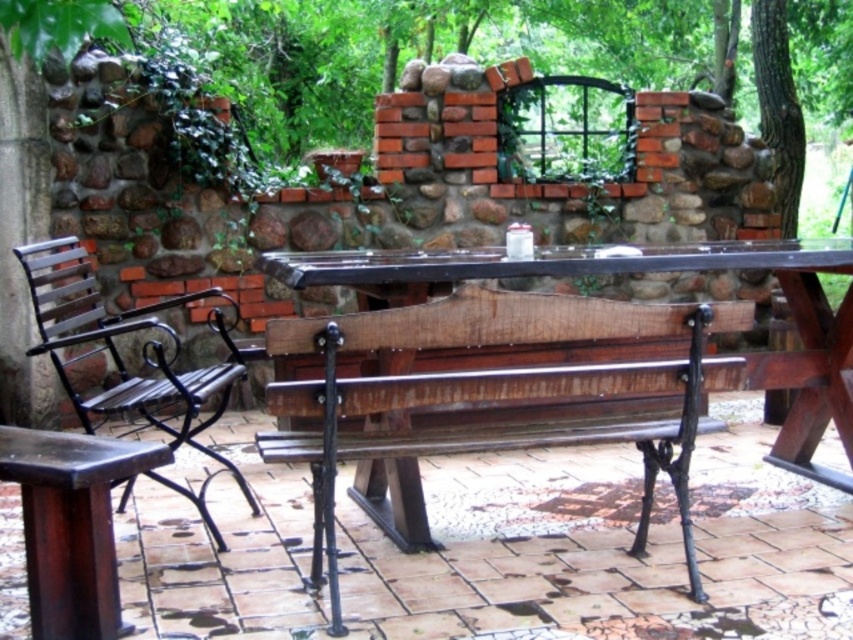
You are sitting on the rustic wood bench at center and want to place a small potted plant between yourself and the black wrought iron chair at left. Is the space between them sufficient for the plant?

The rustic wood bench at center is in front of the black wrought iron chair at left, so there is space between them. The small potted plant can be placed there.

You are a gardener who needs to move the dark brown wood stool at lower left to a different location. However, you notice the rustic wood bench at center is currently blocking your path. Can you move the stool without moving the bench first?

The rustic wood bench at center is positioned over dark brown wood stool at lower left, so you cannot move the dark brown wood stool at lower left without first moving the rustic wood bench at center.

You are a guest at this outdoor seating area and want to choose a seat that is lower to the ground. Which one should you pick between the black wrought iron chair at left and the dark brown wood stool at lower left?

The dark brown wood stool at lower left is shorter than the black wrought iron chair at left, so you should pick the dark brown wood stool at lower left as it is lower to the ground.